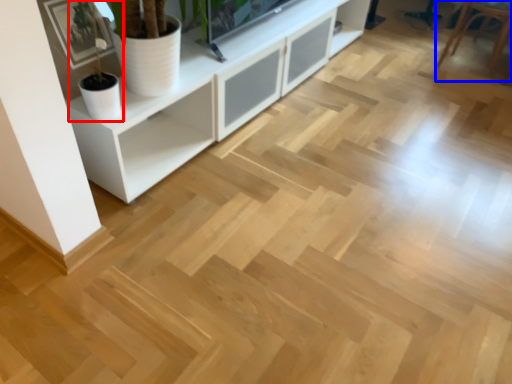
Question: Which object appears closest to the camera in this image, houseplant (highlighted by a red box) or armchair (highlighted by a blue box)?

Choices:
 (A) houseplant
 (B) armchair

Answer: (A)